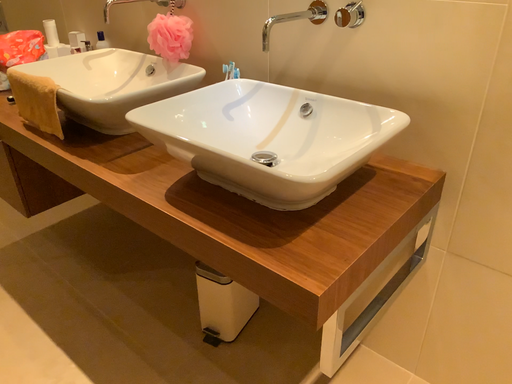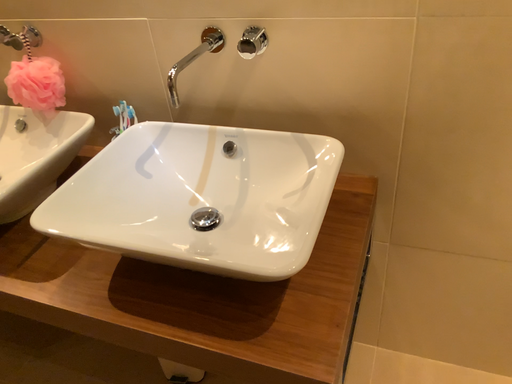
Question: How did the camera likely rotate when shooting the video?

Choices:
 (A) rotated right
 (B) rotated left

Answer: (A)